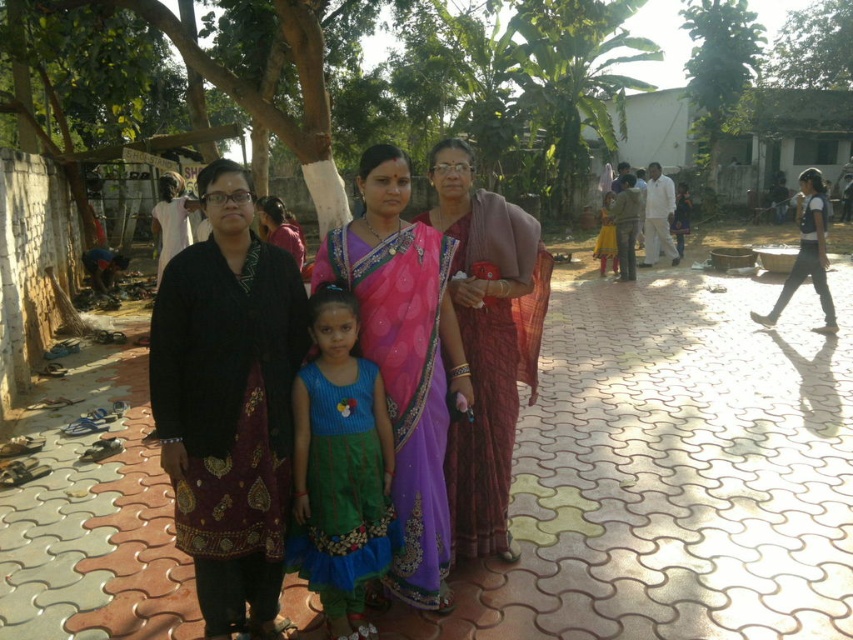
You are a fashion designer observing the group of women. You need to decide which outfit to recommend for a formal event. Considering the length of the black textured dress at center and the purple satin saree at center, which one would be more appropriate for a formal event?

The purple satin saree at center is longer than the black textured dress at center, making it more appropriate for a formal event.

You are a photographer trying to capture a photo of the blue textured dress at center and the green leafy tree at upper right in the background. Can you position yourself so that the dress is in focus while the tree is blurred in the background?

Yes, since the blue textured dress at center is closer to the viewer than the green leafy tree at upper right, you can adjust the camera focus to the dress, making it sharp while the tree in the background becomes blurred.

You are a photographer positioned at the center of the paved area. You need to take a photo that includes both the point at [230,472] and the point at [416,394]. Which point should be placed closer to the front of the photo to ensure both are visible?

Point [230,472] should be placed closer to the front of the photo because it is in front of point [416,394], ensuring both are visible without one blocking the other.